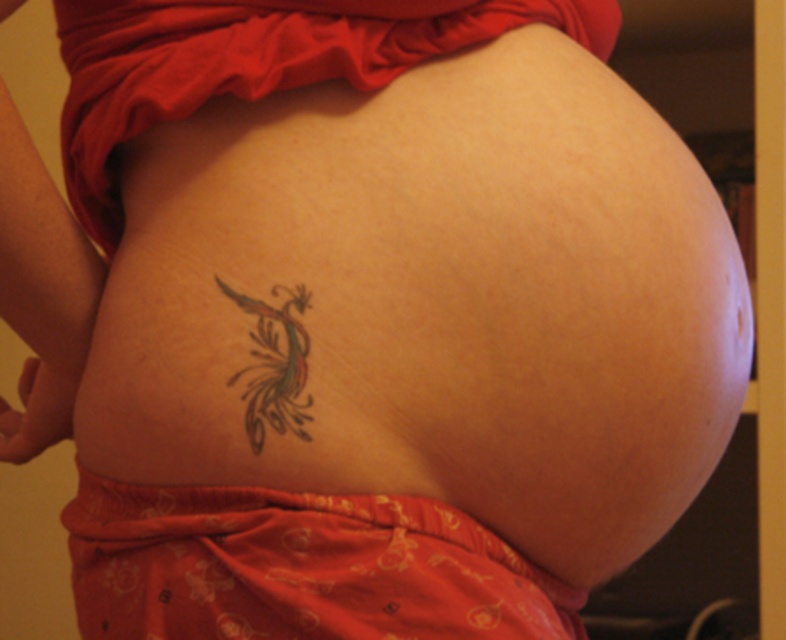
Question: Which point appears closest to the camera in this image?

Choices:
 (A) (274, 308)
 (B) (114, 637)

Answer: (A)

Question: Which object is farther from the camera taking this photo?

Choices:
 (A) multicolored ink dragon at lower center
 (B) matte orange fabric at lower center

Answer: (A)

Question: Does matte orange fabric at lower center appear on the left side of multicolored ink dragon at lower center?

Choices:
 (A) no
 (B) yes

Answer: (A)

Question: Can you confirm if matte orange fabric at lower center is positioned below multicolored ink dragon at lower center?

Choices:
 (A) yes
 (B) no

Answer: (A)

Question: Is matte orange fabric at lower center further to the viewer compared to multicolored ink dragon at lower center?

Choices:
 (A) yes
 (B) no

Answer: (B)

Question: Among these points, which one is nearest to the camera?

Choices:
 (A) (483, 628)
 (B) (300, 304)

Answer: (A)